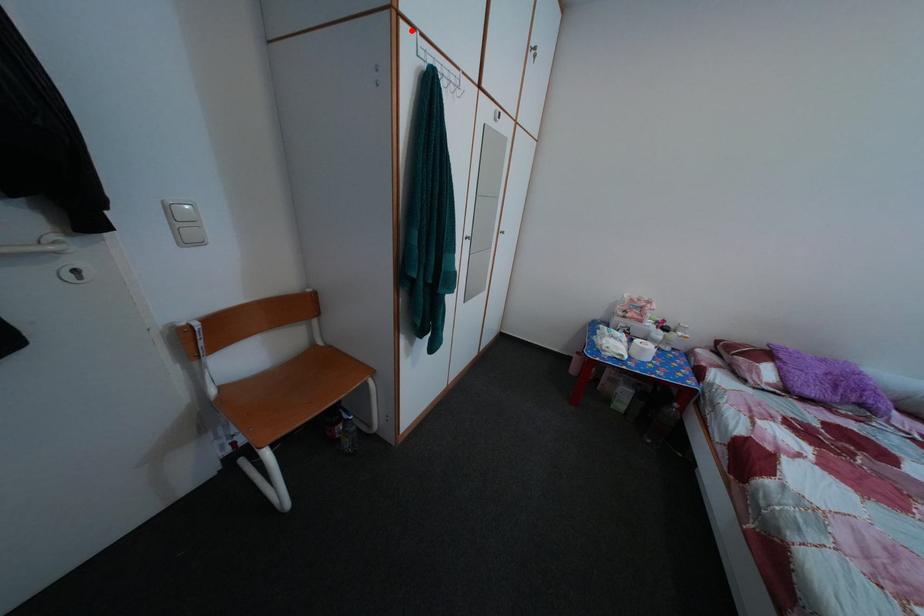
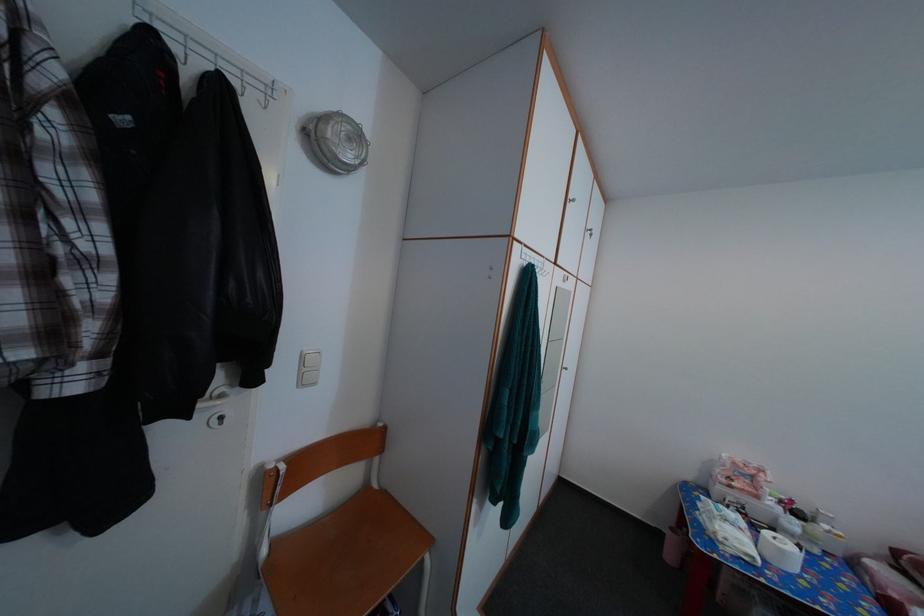
The point at the highlighted location is marked in the first image. Where is the corresponding point in the second image?

(525, 251)